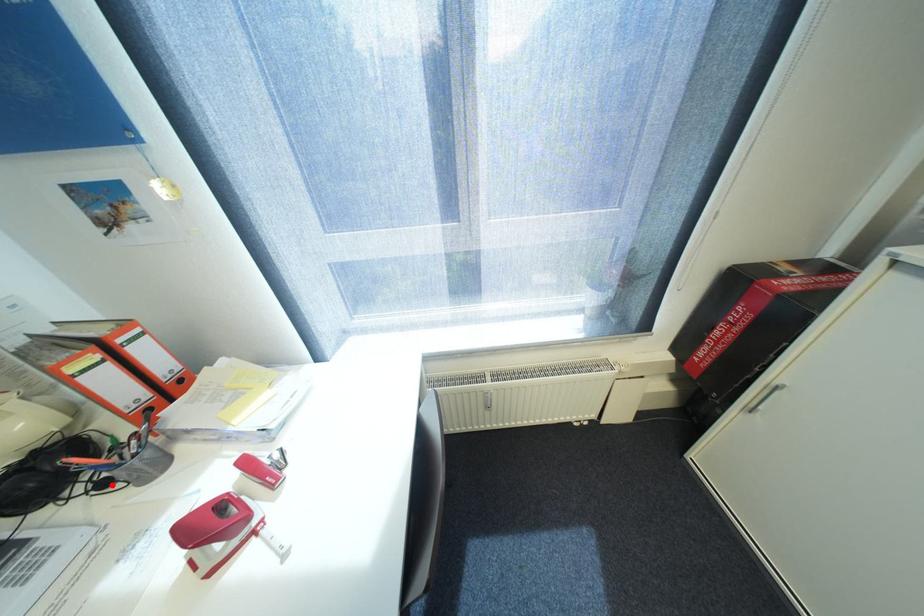
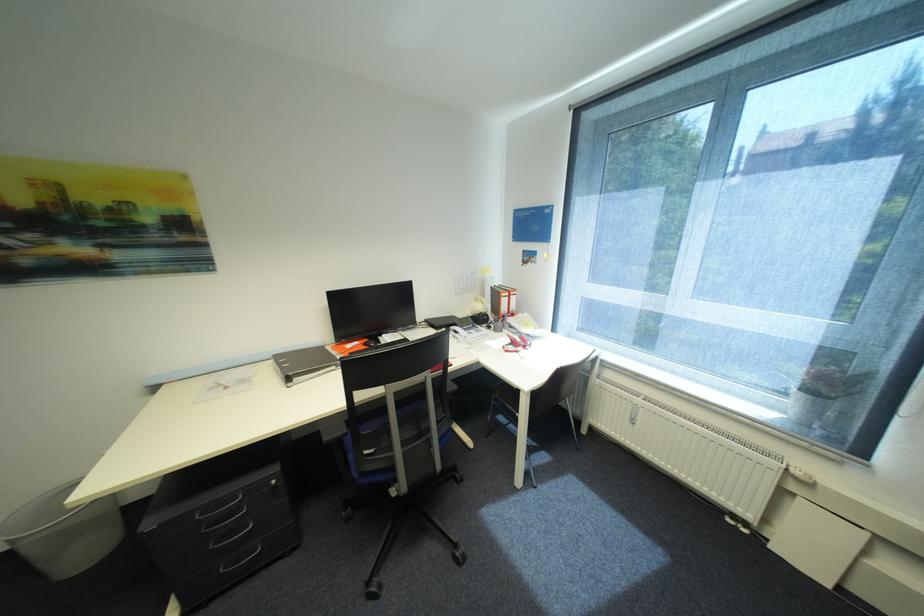
In the second image, find the point that corresponds to the highlighted location in the first image.

(496, 328)